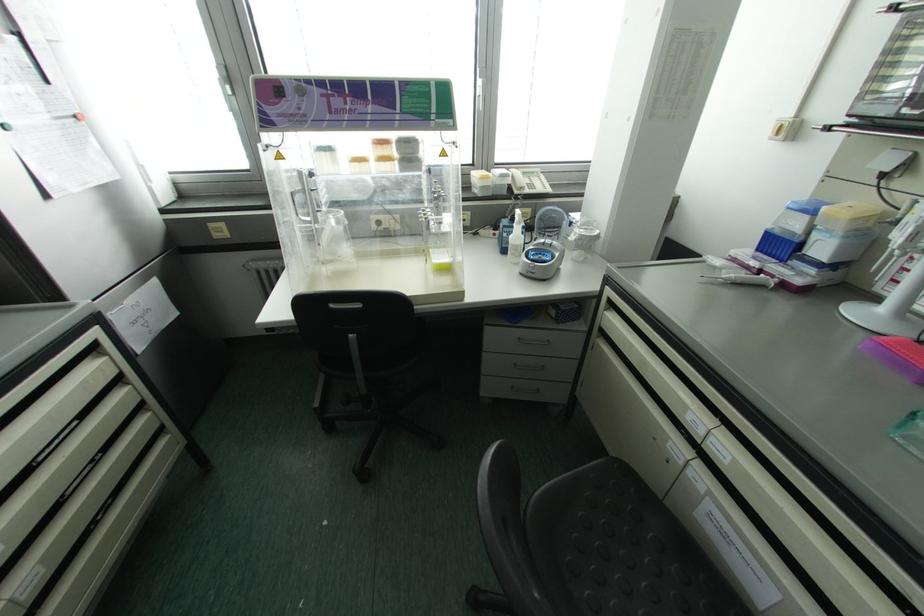
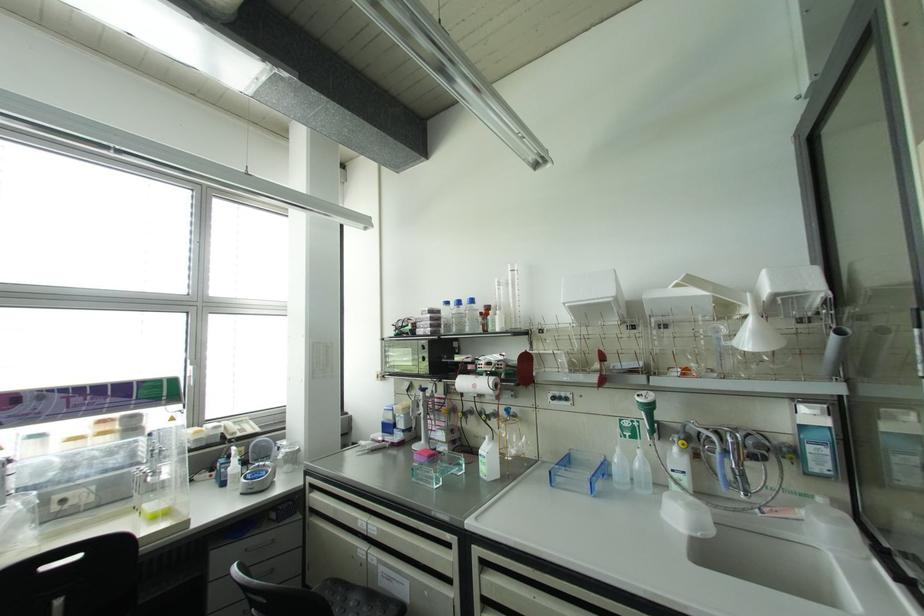
Find the pixel in the second image that matches (x=479, y=82) in the first image.

(189, 368)